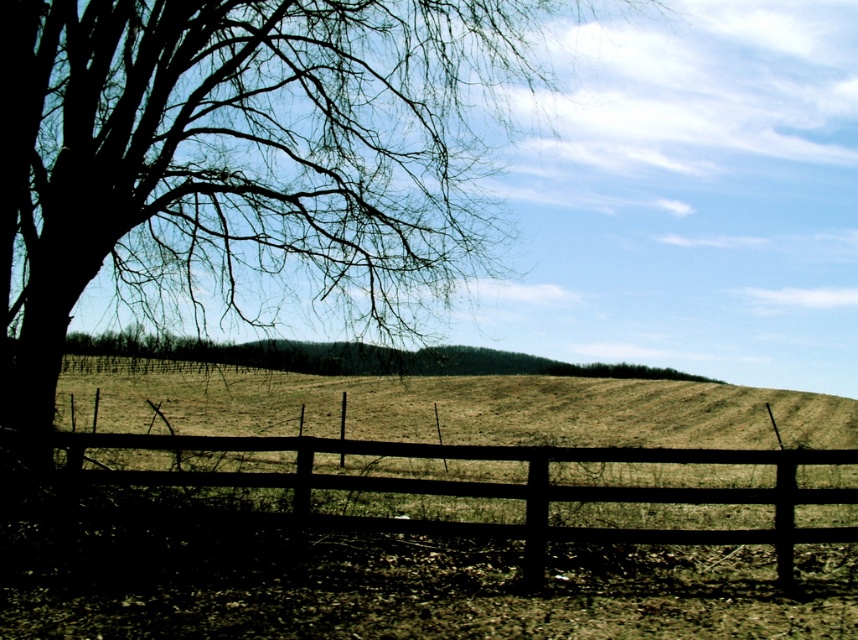
Question: Does brown wooden fence at center have a lesser width compared to brown textured tree at center?

Choices:
 (A) no
 (B) yes

Answer: (A)

Question: Which object is positioned closest to the brown wooden fence at center?

Choices:
 (A) brown textured tree at center
 (B) silhouette bark tree at left

Answer: (A)

Question: Where is silhouette bark tree at left located in relation to brown textured tree at center in the image?

Choices:
 (A) left
 (B) right

Answer: (A)

Question: Which of the following is the farthest from the observer?

Choices:
 (A) silhouette bark tree at left
 (B) brown textured tree at center

Answer: (B)

Question: Estimate the real-world distances between objects in this image. Which object is farther from the silhouette bark tree at left?

Choices:
 (A) brown textured tree at center
 (B) brown wooden fence at center

Answer: (B)

Question: Is silhouette bark tree at left positioned behind brown wooden fence at center?

Choices:
 (A) yes
 (B) no

Answer: (A)